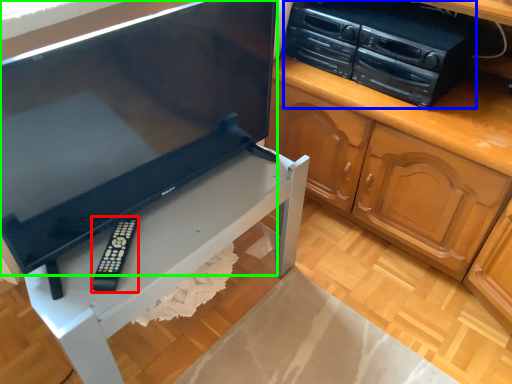
Question: Which is nearer to the remote (highlighted by a red box)? home appliance (highlighted by a blue box) or television (highlighted by a green box).

Choices:
 (A) home appliance
 (B) television

Answer: (B)